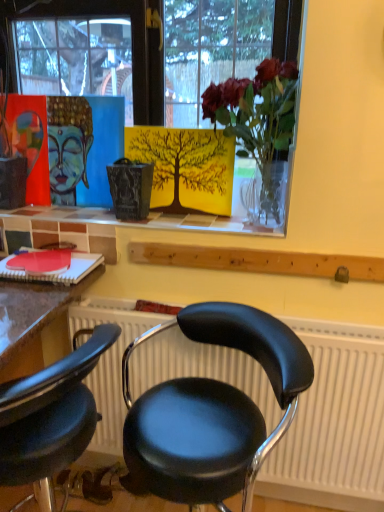
Question: From the image's perspective, would you say black leather chair at lower left, which is counted as the 1th chair, starting from the left, is shown under matte acrylic painting of buddha head at upper left?

Choices:
 (A) yes
 (B) no

Answer: (A)

Question: Could you tell me if black leather chair at lower left, which is counted as the 1th chair, starting from the left, is facing matte acrylic painting of buddha head at upper left?

Choices:
 (A) yes
 (B) no

Answer: (B)

Question: From the image's perspective, would you say black leather chair at lower left, which is counted as the 1th chair, starting from the left, is positioned over matte acrylic painting of buddha head at upper left?

Choices:
 (A) no
 (B) yes

Answer: (A)

Question: Is matte acrylic painting of buddha head at upper left a part of black leather chair at lower left, marked as the 2th chair in a right-to-left arrangement?

Choices:
 (A) no
 (B) yes

Answer: (A)

Question: Is black leather chair at lower left, marked as the 2th chair in a right-to-left arrangement, taller than matte acrylic painting of buddha head at upper left?

Choices:
 (A) yes
 (B) no

Answer: (A)

Question: From a real-world perspective, is black leather chair at lower left, marked as the 2th chair in a right-to-left arrangement, physically below matte acrylic painting of buddha head at upper left?

Choices:
 (A) no
 (B) yes

Answer: (B)

Question: Considering the relative sizes of translucent glass vase at upper center and matte glass vase at upper center in the image provided, is translucent glass vase at upper center smaller than matte glass vase at upper center?

Choices:
 (A) yes
 (B) no

Answer: (B)

Question: Is translucent glass vase at upper center thinner than matte glass vase at upper center?

Choices:
 (A) yes
 (B) no

Answer: (B)

Question: Is translucent glass vase at upper center closer to camera compared to matte glass vase at upper center?

Choices:
 (A) no
 (B) yes

Answer: (B)

Question: Is translucent glass vase at upper center positioned behind matte glass vase at upper center?

Choices:
 (A) no
 (B) yes

Answer: (A)

Question: Is translucent glass vase at upper center bigger than matte glass vase at upper center?

Choices:
 (A) yes
 (B) no

Answer: (A)

Question: Can you confirm if translucent glass vase at upper center is taller than matte glass vase at upper center?

Choices:
 (A) yes
 (B) no

Answer: (A)

Question: Is black leather chair at center, the 2th chair positioned from the left, at the left side of matte glass vase at upper center?

Choices:
 (A) no
 (B) yes

Answer: (A)